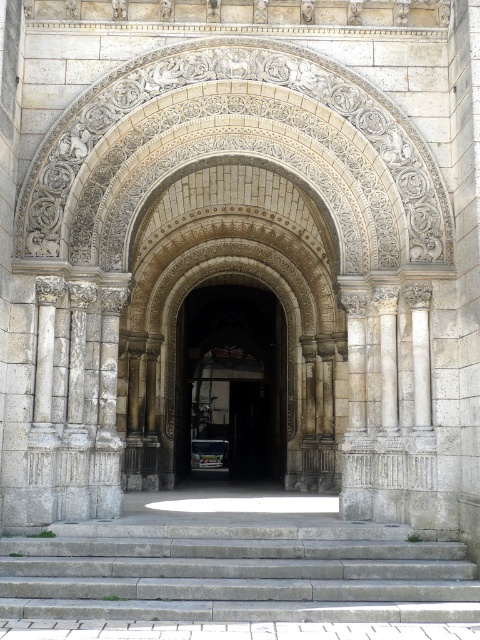
You are standing at the base of the gray concrete stairs at lower center and want to walk towards the dark stone archway at center. Which path should you take to ensure you stay within the structure of the stairs and archway?

Since the gray concrete stairs at lower center are wider than the dark stone archway at center, you should walk towards the center of the stairs to align with the narrower archway, ensuring you stay within the structure.

You are standing at the base of the gray concrete stairs at lower center and want to enter through the dark stone archway at center. Which direction should you move to reach the archway?

The gray concrete stairs at lower center is to the right of the dark stone archway at center, so you should move to the left to reach the archway.